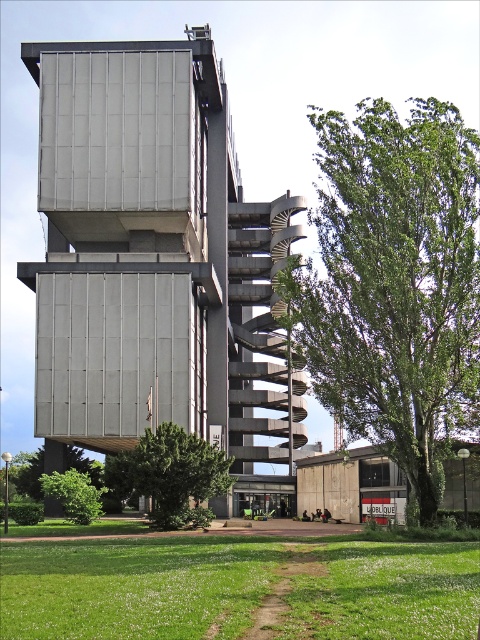
The image size is (480, 640). What do you see at coordinates (237, 588) in the screenshot?
I see `green grass at lower center` at bounding box center [237, 588].

Can you confirm if green grass at lower center is bigger than green leafy tree at center?

Yes, green grass at lower center is bigger than green leafy tree at center.

Which is behind, point (163, 566) or point (167, 493)?

Positioned behind is point (167, 493).

Locate an element on the screen. green grass at lower center is located at coordinates (237, 588).

Between green grass at lower center and green leafy tree at lower left, which one has more height?

With more height is green grass at lower center.

Can you confirm if green grass at lower center is wider than green leafy tree at lower left?

Indeed, green grass at lower center has a greater width compared to green leafy tree at lower left.

You are a GUI agent. You are given a task and a screenshot of the screen. Output one action in this format:
    pyautogui.click(x=<x>, y=<y>)
    Task: Click on the green grass at lower center
    The image size is (480, 640).
    Given the screenshot: What is the action you would take?
    pyautogui.click(x=237, y=588)

Does metallic gray building at center appear on the right side of green leafy tree at right?

Result: No, metallic gray building at center is not to the right of green leafy tree at right.

Is metallic gray building at center bigger than green leafy tree at right?

Indeed, metallic gray building at center has a larger size compared to green leafy tree at right.

Is point (212, 138) positioned behind point (462, 177)?

Yes, point (212, 138) is behind point (462, 177).

At what (x,y) coordinates should I click in order to perform the action: click on metallic gray building at center. Please return your answer as a coordinate pair (x, y). This screenshot has width=480, height=640. Looking at the image, I should click on (156, 260).